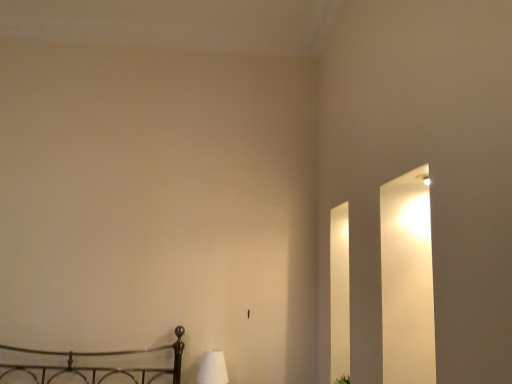
Question: Is white fabric lampshade at lower left further to the viewer compared to green leafy plant at lower right?

Choices:
 (A) no
 (B) yes

Answer: (B)

Question: Is white fabric lampshade at lower left closer to camera compared to green leafy plant at lower right?

Choices:
 (A) no
 (B) yes

Answer: (A)

Question: Considering the relative sizes of white fabric lampshade at lower left and green leafy plant at lower right in the image provided, is white fabric lampshade at lower left thinner than green leafy plant at lower right?

Choices:
 (A) yes
 (B) no

Answer: (B)

Question: Does white fabric lampshade at lower left have a smaller size compared to green leafy plant at lower right?

Choices:
 (A) yes
 (B) no

Answer: (B)

Question: From the image's perspective, would you say white fabric lampshade at lower left is shown under green leafy plant at lower right?

Choices:
 (A) yes
 (B) no

Answer: (B)

Question: Is white fabric lampshade at lower left at the left side of green leafy plant at lower right?

Choices:
 (A) yes
 (B) no

Answer: (A)

Question: Is green leafy plant at lower right positioned beyond the bounds of white fabric lampshade at lower left?

Choices:
 (A) yes
 (B) no

Answer: (A)

Question: Can you confirm if green leafy plant at lower right is smaller than white fabric lampshade at lower left?

Choices:
 (A) no
 (B) yes

Answer: (B)

Question: Considering the relative positions of green leafy plant at lower right and white fabric lampshade at lower left in the image provided, is green leafy plant at lower right to the right of white fabric lampshade at lower left from the viewer's perspective?

Choices:
 (A) no
 (B) yes

Answer: (B)

Question: Is green leafy plant at lower right further to the viewer compared to white fabric lampshade at lower left?

Choices:
 (A) yes
 (B) no

Answer: (B)

Question: Considering the relative sizes of green leafy plant at lower right and white fabric lampshade at lower left in the image provided, is green leafy plant at lower right shorter than white fabric lampshade at lower left?

Choices:
 (A) yes
 (B) no

Answer: (A)

Question: Is green leafy plant at lower right thinner than white fabric lampshade at lower left?

Choices:
 (A) yes
 (B) no

Answer: (A)

Question: From a real-world perspective, relative to green leafy plant at lower right, is white fabric lampshade at lower left vertically above or below?

Choices:
 (A) below
 (B) above

Answer: (B)